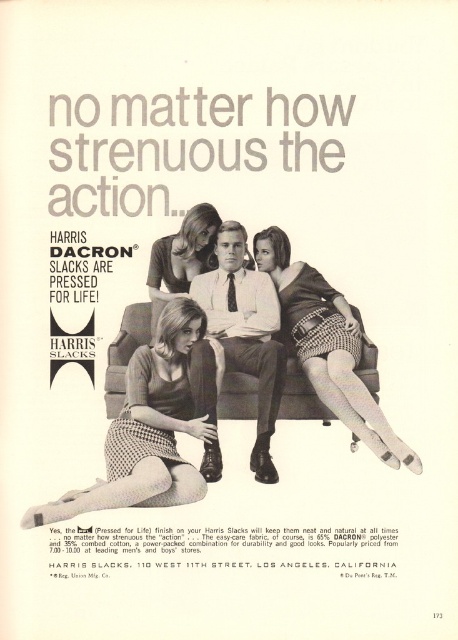
Between matte black slacks at center and matte black dress at center, which one has more height?

matte black slacks at center

Which is behind, point (223, 275) or point (218, 220)?

The point (223, 275) is behind.

I want to click on matte black slacks at center, so click(x=245, y=330).

Which of these two, brown leather couch at center or matte black dress at center, stands taller?

brown leather couch at center

What do you see at coordinates (125, 353) in the screenshot? I see `brown leather couch at center` at bounding box center [125, 353].

The width and height of the screenshot is (458, 640). What are the coordinates of `brown leather couch at center` in the screenshot? It's located at (125, 353).

Between checkered fabric skirt at center and brown leather couch at center, which one is positioned higher?

checkered fabric skirt at center is higher up.

Between checkered fabric skirt at center and brown leather couch at center, which one has less height?

brown leather couch at center is shorter.

Locate an element on the screen. checkered fabric skirt at center is located at coordinates (327, 346).

The image size is (458, 640). Identify the location of checkered fabric skirt at center. (327, 346).